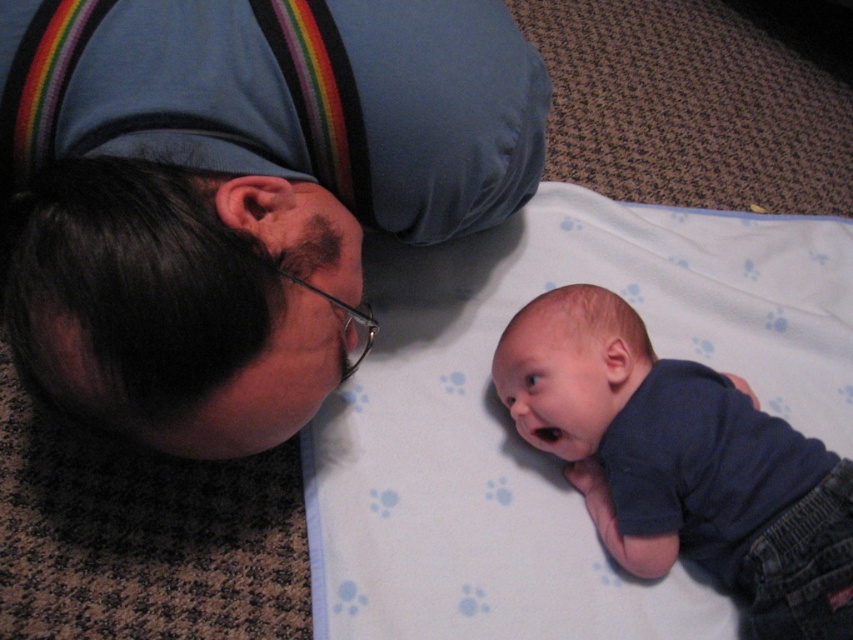
Question: Which of the following is the farthest from the observer?

Choices:
 (A) blue cotton shirt at lower right
 (B) matte black head at upper left

Answer: (A)

Question: Does matte black head at upper left have a larger size compared to blue cotton shirt at lower right?

Choices:
 (A) yes
 (B) no

Answer: (A)

Question: Which point is farther from the camera taking this photo?

Choices:
 (A) (538, 316)
 (B) (155, 300)

Answer: (A)

Question: Can you confirm if matte black head at upper left is bigger than blue cotton shirt at lower right?

Choices:
 (A) no
 (B) yes

Answer: (B)

Question: Which object is closer to the camera taking this photo?

Choices:
 (A) blue cotton shirt at lower right
 (B) matte black head at upper left

Answer: (B)

Question: Is matte black head at upper left to the right of blue cotton shirt at lower right from the viewer's perspective?

Choices:
 (A) no
 (B) yes

Answer: (A)